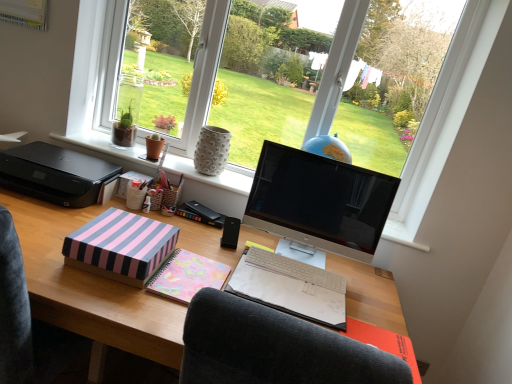
I want to click on free space above pink striped cardboard box at center-left (from a real-world perspective), so click(130, 230).